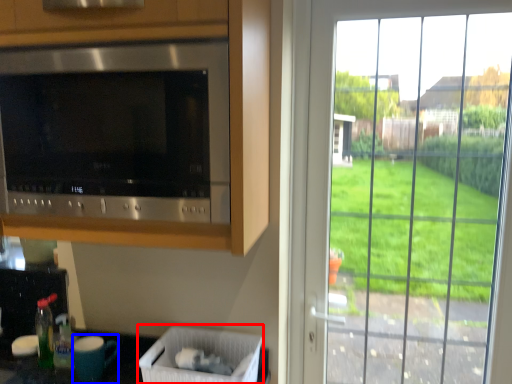
Question: Which object is closer to the camera taking this photo, laundry basket (highlighted by a red box) or appliance (highlighted by a blue box)?

Choices:
 (A) laundry basket
 (B) appliance

Answer: (A)